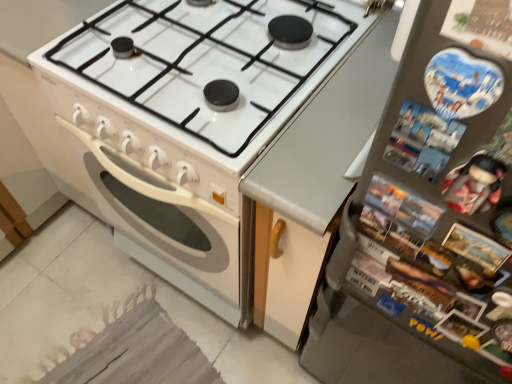
Question: Is metallic gray refrigerator at right turned away from white glossy stove at center?

Choices:
 (A) no
 (B) yes

Answer: (A)

Question: Can you confirm if metallic gray refrigerator at right is shorter than white glossy stove at center?

Choices:
 (A) no
 (B) yes

Answer: (A)

Question: Is metallic gray refrigerator at right in front of white glossy stove at center?

Choices:
 (A) yes
 (B) no

Answer: (A)

Question: Is metallic gray refrigerator at right bigger than white glossy stove at center?

Choices:
 (A) yes
 (B) no

Answer: (B)

Question: Considering the relative positions of metallic gray refrigerator at right and white glossy stove at center in the image provided, is metallic gray refrigerator at right to the right of white glossy stove at center from the viewer's perspective?

Choices:
 (A) yes
 (B) no

Answer: (A)

Question: Does metallic gray refrigerator at right have a smaller size compared to white glossy stove at center?

Choices:
 (A) yes
 (B) no

Answer: (A)

Question: Does white glossy stove at center have a larger size compared to metallic gray refrigerator at right?

Choices:
 (A) no
 (B) yes

Answer: (B)

Question: Is white glossy stove at center in contact with metallic gray refrigerator at right?

Choices:
 (A) no
 (B) yes

Answer: (A)

Question: Considering the relative sizes of white glossy stove at center and metallic gray refrigerator at right in the image provided, is white glossy stove at center wider than metallic gray refrigerator at right?

Choices:
 (A) no
 (B) yes

Answer: (B)

Question: Does white glossy stove at center appear on the right side of metallic gray refrigerator at right?

Choices:
 (A) yes
 (B) no

Answer: (B)

Question: From a real-world perspective, is white glossy stove at center physically above metallic gray refrigerator at right?

Choices:
 (A) no
 (B) yes

Answer: (A)

Question: From the image's perspective, is white glossy stove at center below metallic gray refrigerator at right?

Choices:
 (A) yes
 (B) no

Answer: (B)

Question: From their relative heights in the image, would you say white glossy stove at center is taller or shorter than metallic gray refrigerator at right?

Choices:
 (A) short
 (B) tall

Answer: (A)